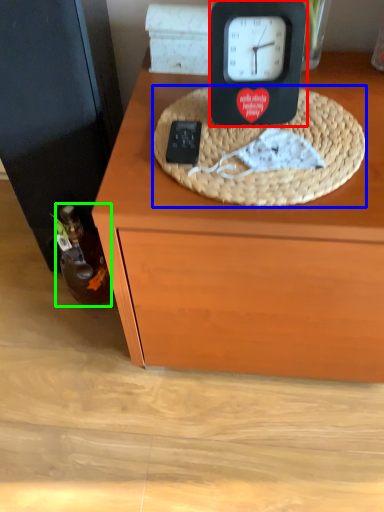
Question: Estimate the real-world distances between objects in this image. Which object is farther from clock (highlighted by a red box), basket (highlighted by a blue box) or bottle (highlighted by a green box)?

Choices:
 (A) basket
 (B) bottle

Answer: (B)